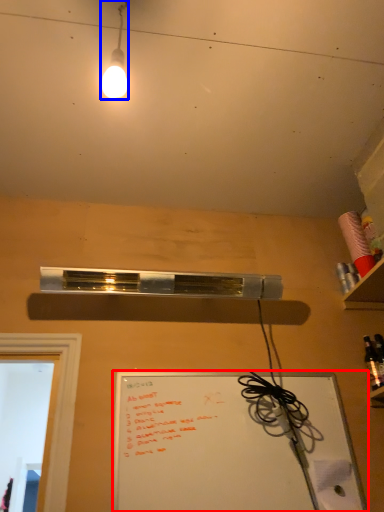
Question: Which point is further to the camera, whiteboard (highlighted by a red box) or lamp (highlighted by a blue box)?

Choices:
 (A) whiteboard
 (B) lamp

Answer: (A)